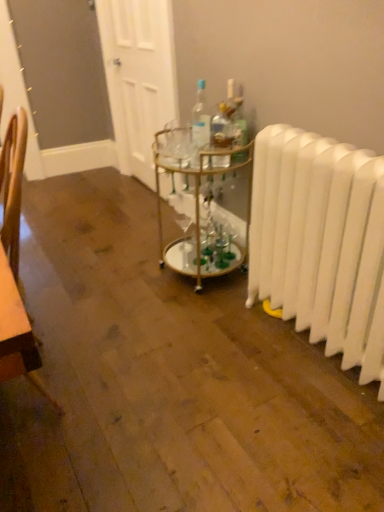
Question: Is clear glass bottle at center, which is counted as the 1th bottle, starting from the left, directly adjacent to translucent glass bottle at center, the 1th bottle positioned from the right?

Choices:
 (A) no
 (B) yes

Answer: (A)

Question: Is clear glass bottle at center, which is counted as the 1th bottle, starting from the left, positioned beyond the bounds of translucent glass bottle at center, the 1th bottle positioned from the right?

Choices:
 (A) yes
 (B) no

Answer: (A)

Question: Is the depth of clear glass bottle at center, which ranks as the third bottle in right-to-left order, greater than that of translucent glass bottle at center, the 1th bottle positioned from the right?

Choices:
 (A) no
 (B) yes

Answer: (B)

Question: From a real-world perspective, does clear glass bottle at center, which is counted as the 1th bottle, starting from the left, sit lower than translucent glass bottle at center, the 1th bottle positioned from the right?

Choices:
 (A) no
 (B) yes

Answer: (A)

Question: Can you confirm if clear glass bottle at center, which is counted as the 1th bottle, starting from the left, is bigger than translucent glass bottle at center, the 1th bottle positioned from the right?

Choices:
 (A) no
 (B) yes

Answer: (B)

Question: From a real-world perspective, relative to gold metallic bar cart at center, is translucent glass bottle at center, the 3th bottle when ordered from left to right, vertically above or below?

Choices:
 (A) below
 (B) above

Answer: (B)

Question: Looking at the image, does translucent glass bottle at center, the 1th bottle positioned from the right, seem bigger or smaller compared to gold metallic bar cart at center?

Choices:
 (A) small
 (B) big

Answer: (A)

Question: Is translucent glass bottle at center, the 3th bottle when ordered from left to right, spatially inside gold metallic bar cart at center, or outside of it?

Choices:
 (A) inside
 (B) outside

Answer: (A)

Question: Is translucent glass bottle at center, the 3th bottle when ordered from left to right, in front of or behind gold metallic bar cart at center in the image?

Choices:
 (A) behind
 (B) front

Answer: (A)

Question: Does point (195, 115) appear closer or farther from the camera than point (226, 124)?

Choices:
 (A) farther
 (B) closer

Answer: (A)

Question: Considering the positions of clear glass bottle at center, which ranks as the third bottle in right-to-left order, and clear glass bottle at center, acting as the 2th bottle starting from the left, in the image, is clear glass bottle at center, which ranks as the third bottle in right-to-left order, taller or shorter than clear glass bottle at center, acting as the 2th bottle starting from the left,?

Choices:
 (A) short
 (B) tall

Answer: (B)

Question: Is clear glass bottle at center, which is counted as the 1th bottle, starting from the left, inside the boundaries of clear glass bottle at center, acting as the 2th bottle starting from the left, or outside?

Choices:
 (A) inside
 (B) outside

Answer: (B)

Question: In the image, is clear glass bottle at center, which is counted as the 1th bottle, starting from the left, on the left side or the right side of clear glass bottle at center, which appears as the second bottle when viewed from the right?

Choices:
 (A) right
 (B) left

Answer: (B)

Question: Is clear glass bottle at center, which appears as the second bottle when viewed from the right, to the left or to the right of white plastic radiator at right in the image?

Choices:
 (A) left
 (B) right

Answer: (A)

Question: From the image's perspective, relative to white plastic radiator at right, is clear glass bottle at center, which appears as the second bottle when viewed from the right, above or below?

Choices:
 (A) above
 (B) below

Answer: (A)